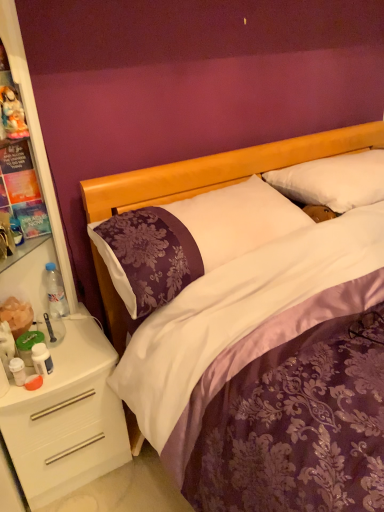
This screenshot has height=512, width=384. In order to click on vacant space to the right of clear plastic bottle at left in this screenshot , I will do `click(81, 320)`.